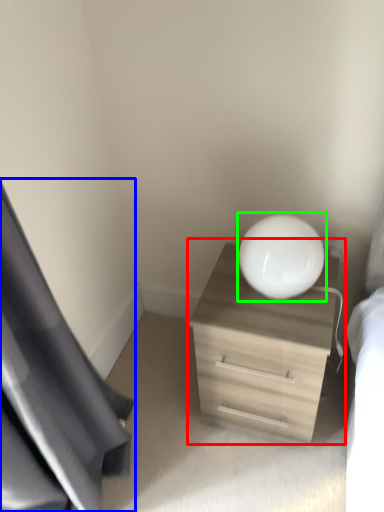
Question: Considering the real-world distances, which object is farthest from dresser (highlighted by a red box)? curtain (highlighted by a blue box) or round table (highlighted by a green box)?

Choices:
 (A) curtain
 (B) round table

Answer: (A)